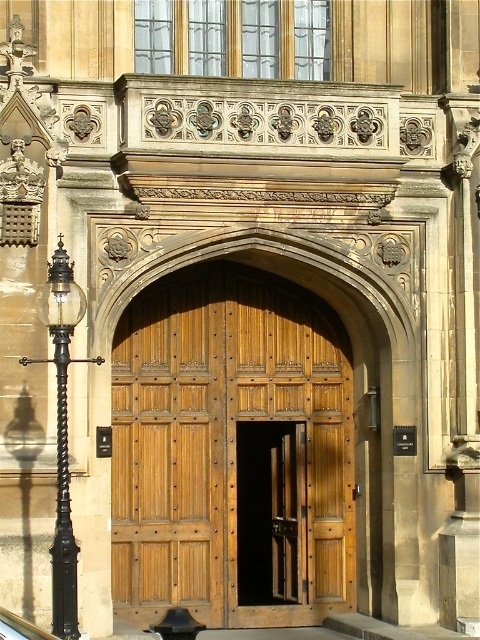
You are standing in front of the grand entrance and want to determine the relative positions of two points marked on the door. The first point is at coordinates point (332, 371) and the second is at point (27, 632). Which point is closer to you?

Point (332, 371) is further to the viewer than point (27, 632), so the second point is closer to you.

You are standing in front of the grand entrance. There is a point marked at coordinates (227, 444). What object is located at that point?

The point at coordinates (227, 444) indicates the wooden panelled door at center.

You are a delivery person trying to enter the building through the wooden panelled door at center. The black glass car at lower left is blocking the entrance. Can you tell me if the door is taller than the car?

The wooden panelled door at center has a greater height compared to the black glass car at lower left, so yes, the door is taller than the car.